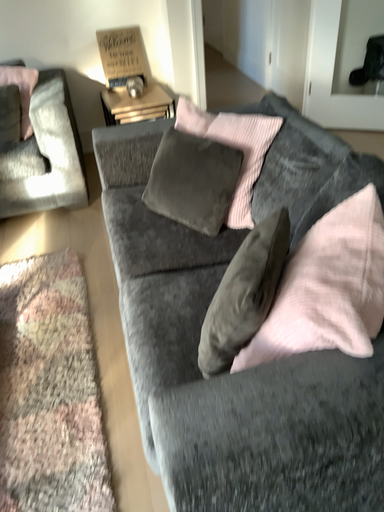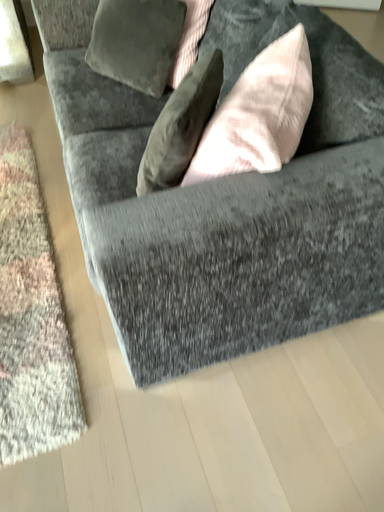
Question: Which way did the camera rotate in the video?

Choices:
 (A) rotated upward
 (B) rotated downward

Answer: (B)